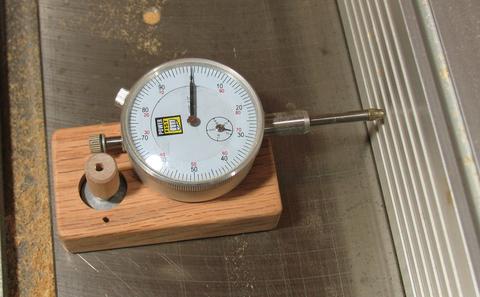
I want to click on wood base, so click(174, 225).